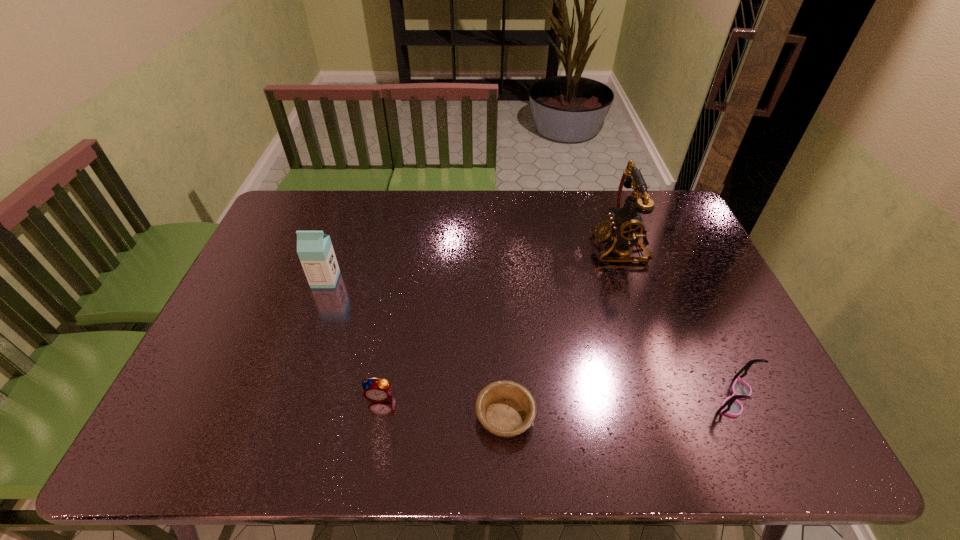
Locate an element on the screen. This screenshot has height=540, width=960. blank area in the image that satisfies the following two spatial constraints: 1. on the back side of the third object from right to left; 2. on the right side of the rightmost object is located at coordinates (504, 399).

The width and height of the screenshot is (960, 540). Find the location of `vacant space that satisfies the following two spatial constraints: 1. on the front-facing side of the rightmost object; 2. on the right side of the fourth object from right to left`. vacant space that satisfies the following two spatial constraints: 1. on the front-facing side of the rightmost object; 2. on the right side of the fourth object from right to left is located at coordinates (379, 399).

The image size is (960, 540). In order to click on free space that satisfies the following two spatial constraints: 1. on the front of the rightmost object, featuring the rotary dial; 2. on the right side of the tallest object in this screenshot , I will do click(x=671, y=399).

Locate an element on the screen. This screenshot has height=540, width=960. vacant space that satisfies the following two spatial constraints: 1. on the front of the fourth object from left to right, featuring the rotary dial; 2. on the back side of the rightmost object is located at coordinates (671, 399).